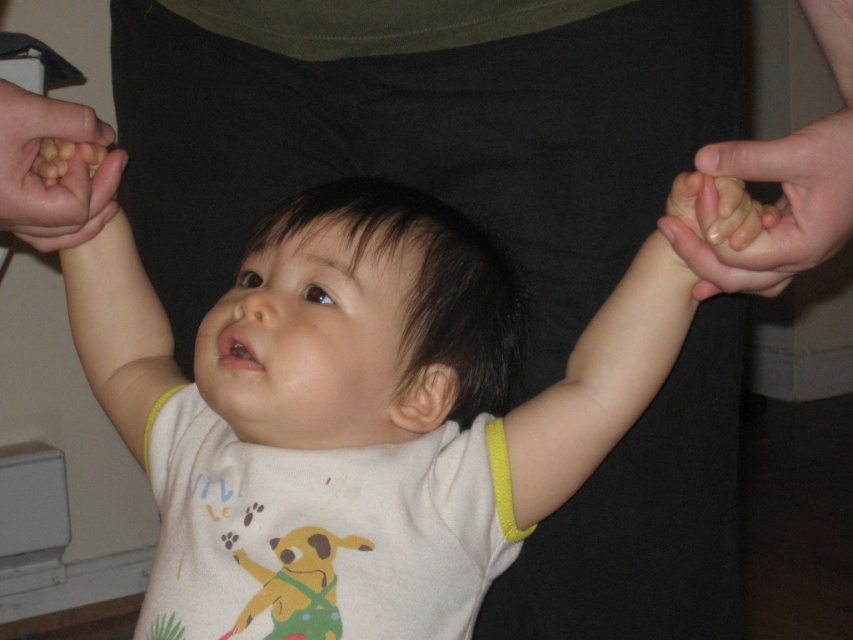
You are a photographer setting up a photo shoot. You need to place a small prop between the yellow fabric arm at upper left and the yellow fabric wristband at right. Based on their positions, where should you place the prop so it is centered between them?

The yellow fabric arm at upper left is located above the yellow fabric wristband at right, so to center the prop between them, place it halfway between their vertical positions, closer to the middle of the image.

Looking at the scene where a child is being held by two adults, you notice two yellow items. The first is a yellow fabric arm at upper left and the second is a yellow fabric wristband at right. Which of these yellow items is positioned more to the left side of the image?

The yellow fabric arm at upper left is positioned to the left of the yellow fabric wristband at right, so the yellow fabric arm at upper left is more to the left.

You are a physical therapist observing a child learning to stand. You see the yellow fabric arm at upper left and the smooth skin hand at right holding the child. Which support point is higher up on the child?

The yellow fabric arm at upper left is much taller than the smooth skin hand at right, so the yellow fabric arm at upper left is higher up on the child.